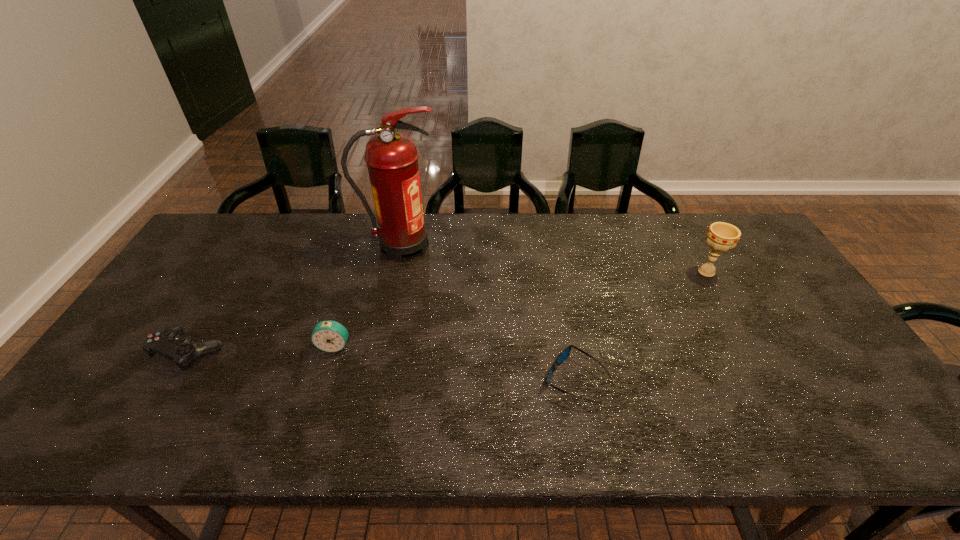
Image resolution: width=960 pixels, height=540 pixels. What are the coordinates of `vacant region located 0.180m on the right of the second farthest object` in the screenshot? It's located at (779, 272).

Locate an element on the screen. vacant point located on the front-facing side of the third shortest object is located at coordinates (308, 434).

Identify the location of vacant space located on the back of the leftmost object. The height and width of the screenshot is (540, 960). (254, 242).

Identify the location of free space located at the front of the second object from right to left showing the lenses. This screenshot has width=960, height=540. (404, 380).

I want to click on vacant space located at the front of the second object from right to left showing the lenses, so click(x=457, y=380).

At what (x,y) coordinates should I click in order to perform the action: click on vacant space located 0.340m at the front of the second object from right to left showing the lenses. Please return your answer as a coordinate pair (x, y). Looking at the image, I should click on (404, 380).

The image size is (960, 540). I want to click on object located in the far edge section of the desktop, so click(392, 158).

Locate an element on the screen. The image size is (960, 540). object located at the left edge is located at coordinates (169, 342).

Locate an element on the screen. The height and width of the screenshot is (540, 960). vacant space at the far edge of the desktop is located at coordinates (524, 231).

Locate an element on the screen. free space at the near edge of the desktop is located at coordinates pos(670,432).